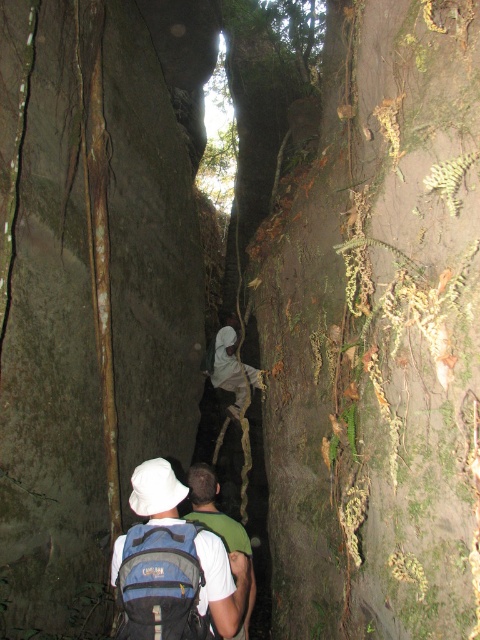
Based on the photo, does blue fabric backpack at center have a lesser width compared to white matte backpack at center?

Incorrect, blue fabric backpack at center's width is not less than white matte backpack at center's.

Between point (180, 634) and point (239, 538), which one is positioned behind?

The point (239, 538) is more distant.

Locate an element on the screen. Image resolution: width=480 pixels, height=640 pixels. blue fabric backpack at center is located at coordinates (173, 564).